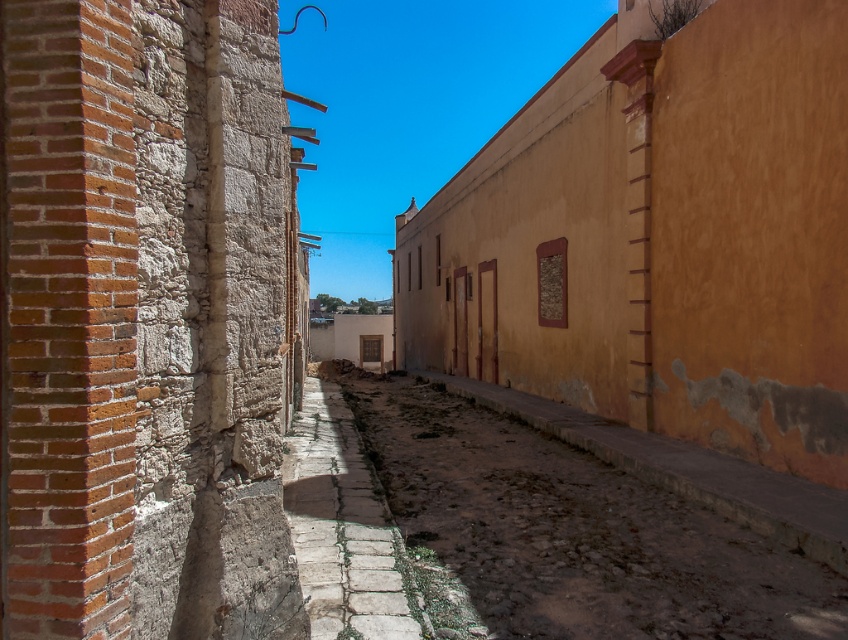
How far apart are dirt cobblestone path at center and stone paved path at center?

dirt cobblestone path at center is 4.65 feet away from stone paved path at center.

Which of these two, dirt cobblestone path at center or stone paved path at center, stands shorter?

dirt cobblestone path at center is shorter.

Identify the location of dirt cobblestone path at center. This screenshot has height=640, width=848. (573, 531).